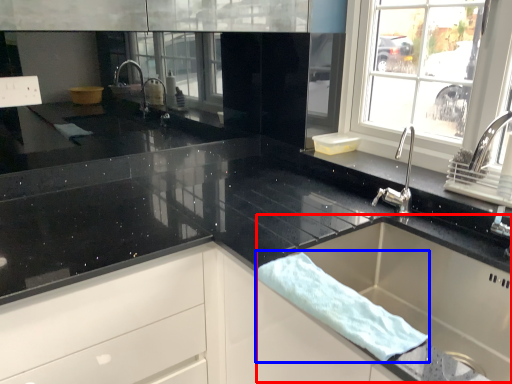
Question: Which object is closer to the camera taking this photo, sink (highlighted by a red box) or bath towel (highlighted by a blue box)?

Choices:
 (A) sink
 (B) bath towel

Answer: (B)